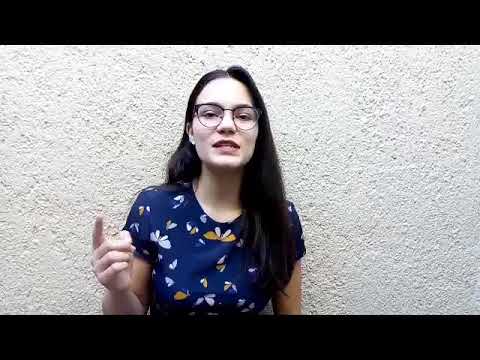
The width and height of the screenshot is (480, 360). I want to click on white textured wall, so click(327, 172).